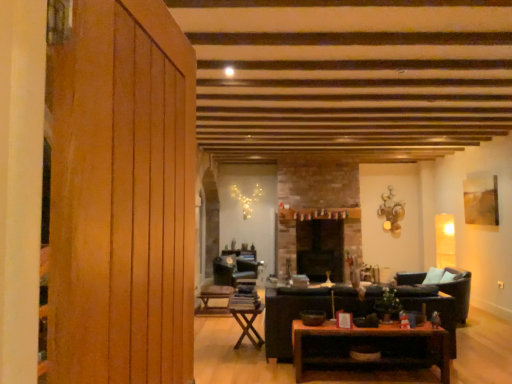
Question: Should I look upward or downward to see wooden folding table at center, the second table viewed from the left?

Choices:
 (A) up
 (B) down

Answer: (B)

Question: Considering the relative sizes of brown wooden table at center, the first table from the right, and wooden folding table at center, arranged as the third table when viewed from the right, in the image provided, is brown wooden table at center, the first table from the right, shorter than wooden folding table at center, arranged as the third table when viewed from the right,?

Choices:
 (A) no
 (B) yes

Answer: (A)

Question: From the image's perspective, is brown wooden table at center, which is the 3th table from left to right, below wooden folding table at center, arranged as the third table when viewed from the right?

Choices:
 (A) yes
 (B) no

Answer: (B)

Question: Is brown wooden table at center, the third table from the back, bigger than wooden folding table at center, positioned as the 1th table in back-to-front order?

Choices:
 (A) yes
 (B) no

Answer: (A)

Question: From the image's perspective, does brown wooden table at center, the third table from the back, appear higher than wooden folding table at center, which ranks as the 1th table in left-to-right order?

Choices:
 (A) yes
 (B) no

Answer: (A)

Question: Is brown wooden table at center, the third table from the back, far away from wooden folding table at center, arranged as the third table when viewed from the right?

Choices:
 (A) no
 (B) yes

Answer: (B)

Question: Considering the relative positions of brown wooden table at center, the third table from the back, and wooden folding table at center, which is the 3th table from front to back, in the image provided, is brown wooden table at center, the third table from the back, to the left of wooden folding table at center, which is the 3th table from front to back, from the viewer's perspective?

Choices:
 (A) yes
 (B) no

Answer: (B)

Question: From a real-world perspective, is black leather couch at center under wooden folding table at center, which is the 3th table from front to back?

Choices:
 (A) yes
 (B) no

Answer: (B)

Question: Is there a large distance between black leather couch at center and wooden folding table at center, which is the 3th table from front to back?

Choices:
 (A) no
 (B) yes

Answer: (B)

Question: From the image's perspective, would you say black leather couch at center is shown under wooden folding table at center, arranged as the third table when viewed from the right?

Choices:
 (A) no
 (B) yes

Answer: (A)

Question: Is black leather couch at center taller than wooden folding table at center, which is the 3th table from front to back?

Choices:
 (A) yes
 (B) no

Answer: (A)

Question: From the image's perspective, is black leather couch at center over wooden folding table at center, which is the 3th table from front to back?

Choices:
 (A) yes
 (B) no

Answer: (A)

Question: Is the surface of black leather couch at center in direct contact with wooden folding table at center, arranged as the third table when viewed from the right?

Choices:
 (A) yes
 (B) no

Answer: (B)

Question: Is black leather couch at center wider than wooden paneling at left?

Choices:
 (A) no
 (B) yes

Answer: (B)